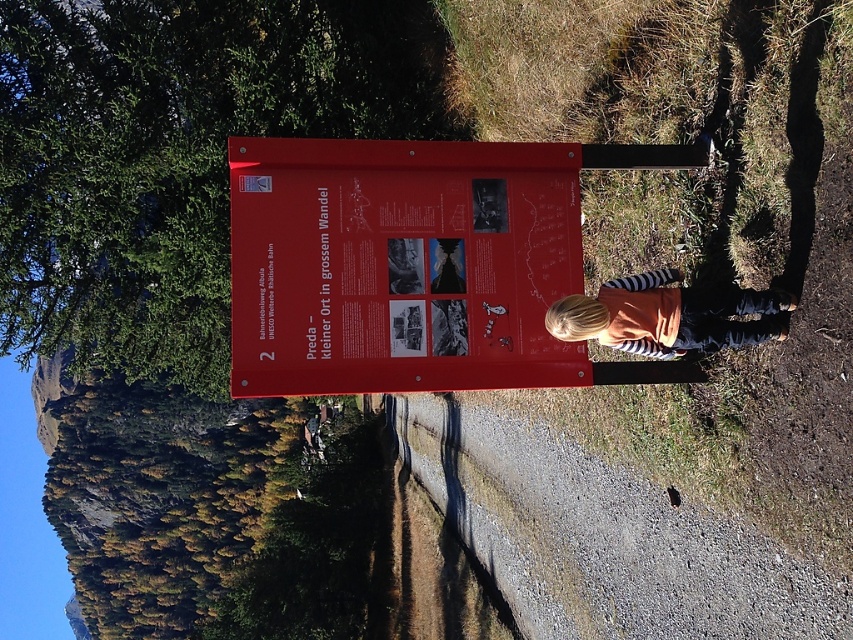
Question: Is red matte sign at center wider than orange cotton shirt at center?

Choices:
 (A) yes
 (B) no

Answer: (A)

Question: Does red matte sign at center appear over orange cotton shirt at center?

Choices:
 (A) no
 (B) yes

Answer: (B)

Question: Observing the image, what is the correct spatial positioning of red matte sign at center in reference to orange cotton shirt at center?

Choices:
 (A) below
 (B) above

Answer: (B)

Question: Among these points, which one is farthest from the camera?

Choices:
 (A) (294, 268)
 (B) (587, 314)

Answer: (A)

Question: Among these points, which one is nearest to the camera?

Choices:
 (A) (656, 284)
 (B) (361, 234)

Answer: (A)

Question: Which of the following is the farthest from the observer?

Choices:
 (A) (601, 310)
 (B) (486, 259)

Answer: (B)